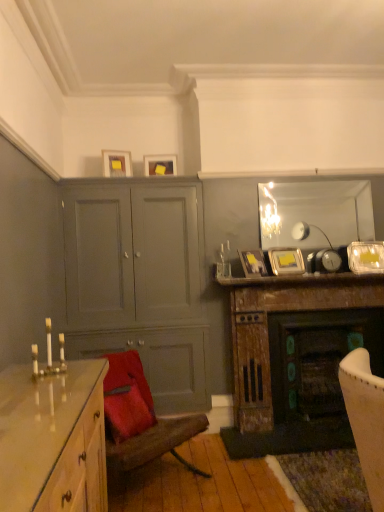
Where is `vacant space in metallic silver picture frame at upper center, the second picture frame positioned from the right (from a real-world perspective)`? The height and width of the screenshot is (512, 384). vacant space in metallic silver picture frame at upper center, the second picture frame positioned from the right (from a real-world perspective) is located at coordinates (285, 277).